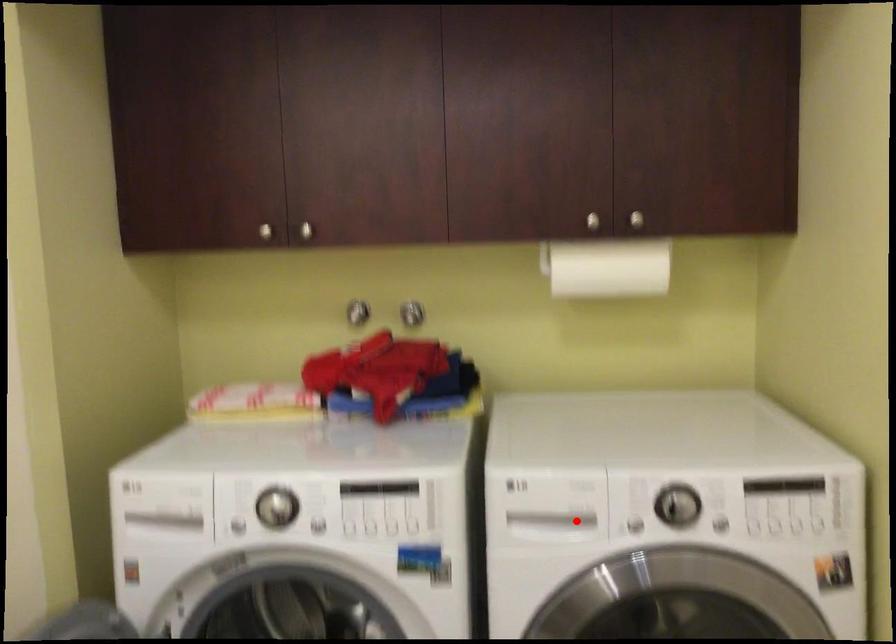
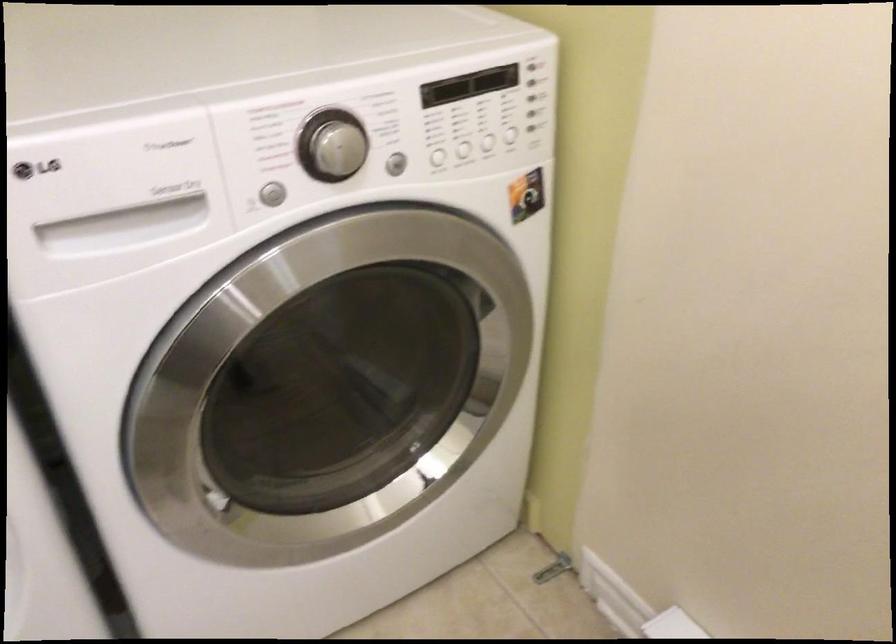
Question: I am providing you with two images of the same scene from different viewpoints. A red point is marked on the first image. At the location where the point appears in image 1, is it still visible in image 2?

Choices:
 (A) Yes
 (B) No

Answer: (A)